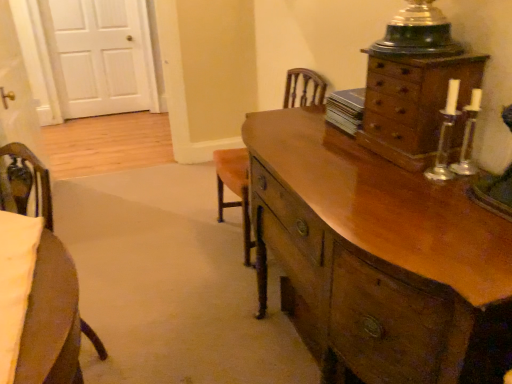
Locate an element on the screen. free space on the front side of wooden chest of drawers at upper right, the 2th chest of drawers positioned from the bottom is located at coordinates (409, 193).